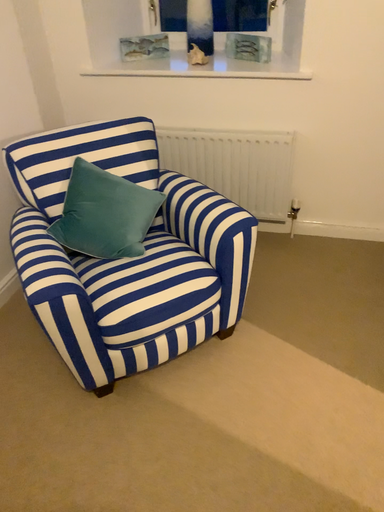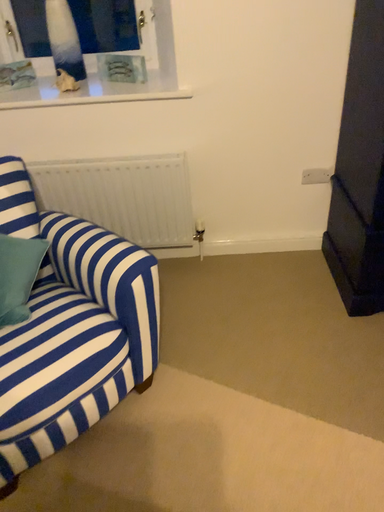
Question: How did the camera likely rotate when shooting the video?

Choices:
 (A) rotated left
 (B) rotated right

Answer: (B)